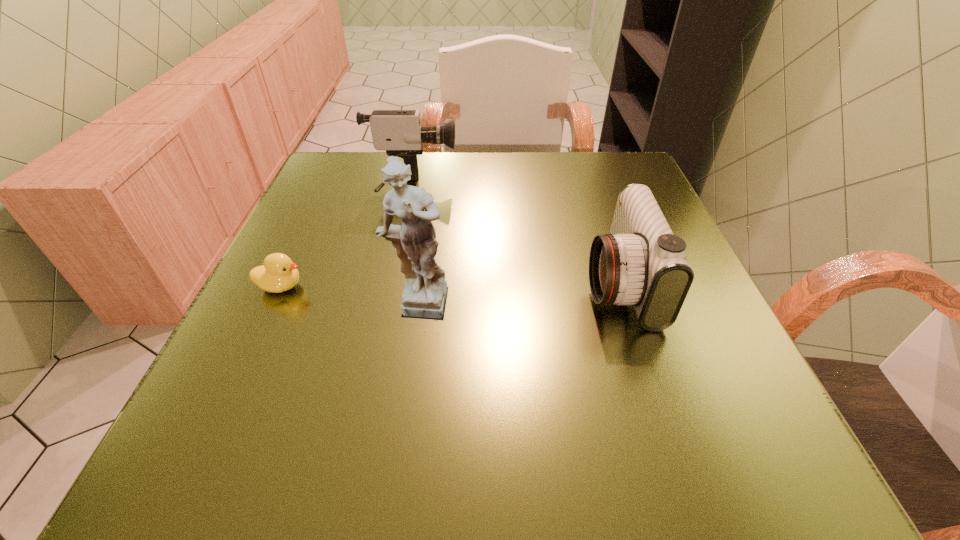
Find the location of a particular element. vacant space at the left edge of the desktop is located at coordinates (296, 302).

This screenshot has height=540, width=960. In order to click on free space at the right edge of the desktop in this screenshot , I will do `click(702, 348)`.

In order to click on vacant area at the far left corner of the desktop in this screenshot , I will do `click(366, 158)`.

Where is `blank space at the far right corner of the desktop`? blank space at the far right corner of the desktop is located at coordinates (624, 158).

I want to click on free spot between the farther camcorder and the shortest object, so click(346, 238).

Where is `unoccupied area between the rightmost object and the shortest object`? unoccupied area between the rightmost object and the shortest object is located at coordinates (449, 285).

Where is `unoccupied position between the duckling and the farthest object`? unoccupied position between the duckling and the farthest object is located at coordinates (346, 238).

At what (x,y) coordinates should I click in order to perform the action: click on empty space between the farther camcorder and the shortest object. Please return your answer as a coordinate pair (x, y). The image size is (960, 540). Looking at the image, I should click on (346, 238).

Image resolution: width=960 pixels, height=540 pixels. I want to click on free spot between the shortest object and the farthest object, so click(346, 238).

I want to click on blank region between the shortest object and the right camcorder, so 449,285.